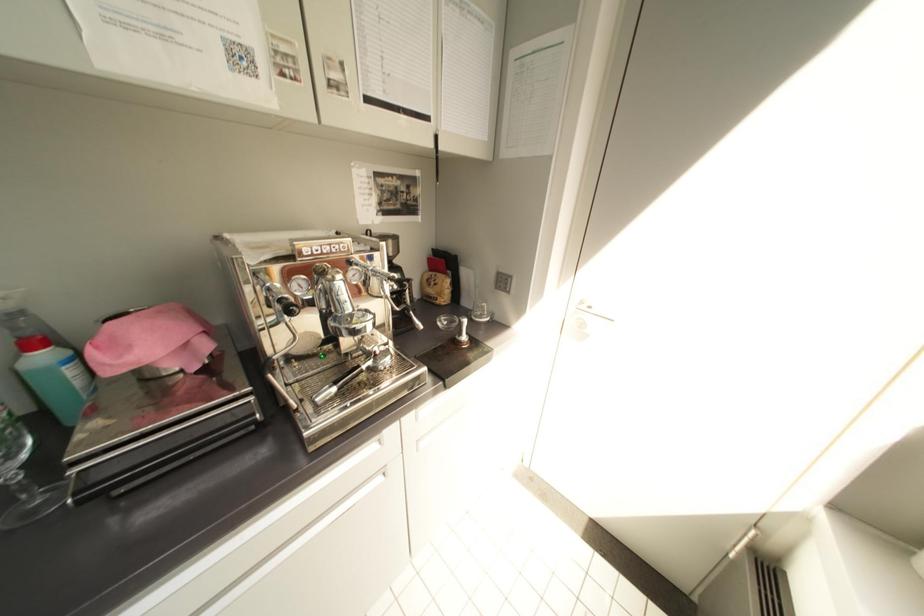
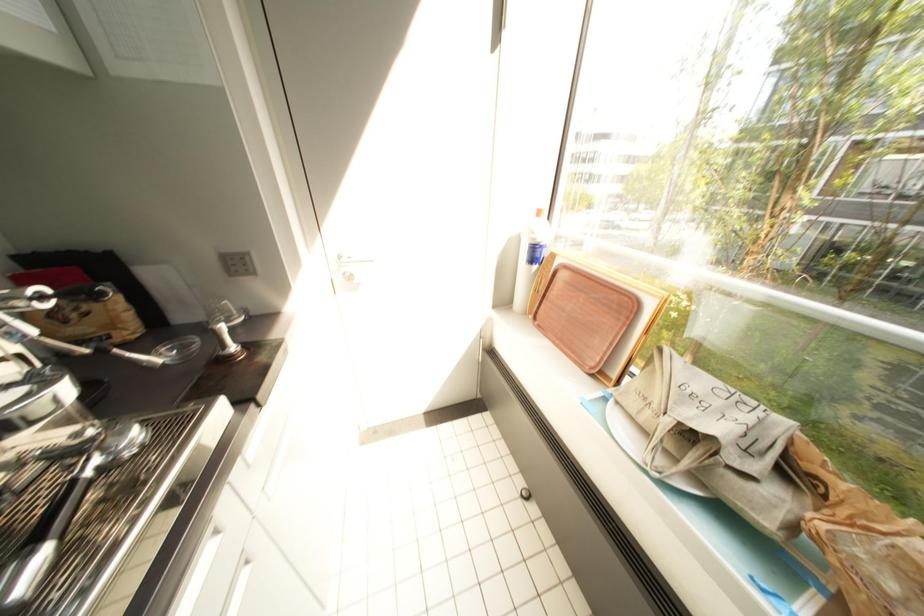
The first image is from the beginning of the video and the second image is from the end. How did the camera likely rotate when shooting the video?

The camera's rotation is toward right-down.